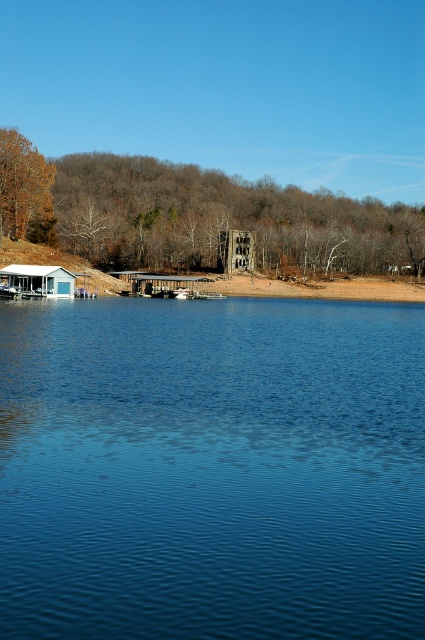
Is blue liquid water at center bigger than wooden cabin at center?

Yes, blue liquid water at center is bigger than wooden cabin at center.

Between blue liquid water at center and wooden cabin at center, which one appears on the right side from the viewer's perspective?

From the viewer's perspective, wooden cabin at center appears more on the right side.

Is point (258, 532) more distant than point (246, 243)?

No, (258, 532) is in front of (246, 243).

Find the location of `blue liquid water at center`. blue liquid water at center is located at coordinates (212, 468).

Which of these two, white wood cabin at lower left or wooden cabin at center, stands taller?

Standing taller between the two is wooden cabin at center.

Can you confirm if white wood cabin at lower left is positioned to the left of wooden cabin at center?

Yes, white wood cabin at lower left is to the left of wooden cabin at center.

The width and height of the screenshot is (425, 640). Describe the element at coordinates (40, 280) in the screenshot. I see `white wood cabin at lower left` at that location.

I want to click on white wood cabin at lower left, so 40,280.

Is wooden cabin at center positioned before metallic gray dock at center?

That is False.

Measure the distance from wooden cabin at center to metallic gray dock at center.

The distance of wooden cabin at center from metallic gray dock at center is 16.83 meters.

Between point (249, 236) and point (150, 276), which one is positioned behind?

Positioned behind is point (249, 236).

Where is `wooden cabin at center`? Image resolution: width=425 pixels, height=640 pixels. wooden cabin at center is located at coordinates (235, 250).